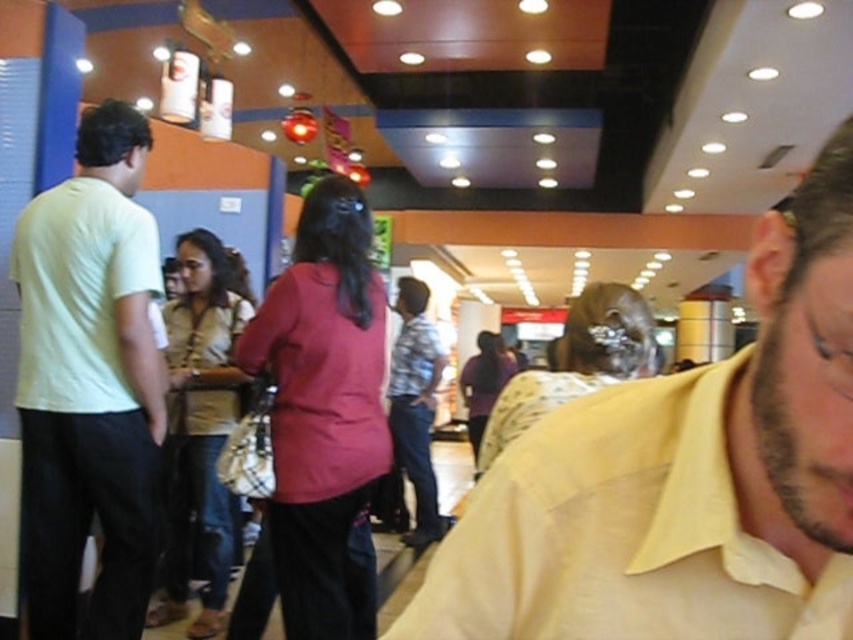
You are standing in the food court and want to reach a specific point marked at coordinates point [730,561]. If your arm length is 24 inches, can you reach that point without moving your feet?

The distance of point [730,561] from viewer is 17.94 inches, so yes, you can reach it with your arm since your arm length is longer than the distance.

Where is the yellow cotton shirt at center located in the image?

The yellow cotton shirt at center is located at point (683, 476) in the image.

Based on the coordinates provided, can you identify which object is located at point (683, 476) in the scene?

The point (683, 476) corresponds to the yellow cotton shirt at center.